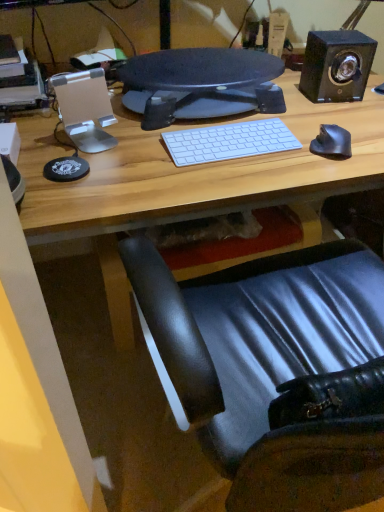
Locate an element on the screen. free location in front of black glossy speaker at upper right is located at coordinates (336, 117).